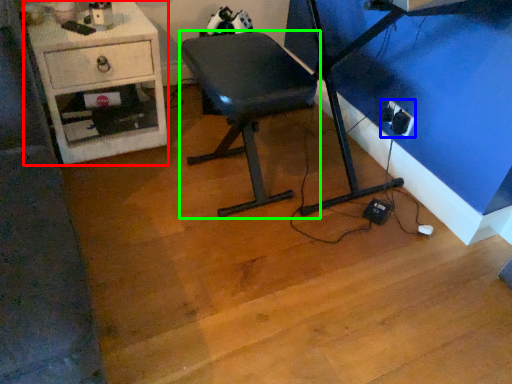
Question: Which is farther away from desk (highlighted by a red box)? electric outlet (highlighted by a blue box) or furniture (highlighted by a green box)?

Choices:
 (A) electric outlet
 (B) furniture

Answer: (A)